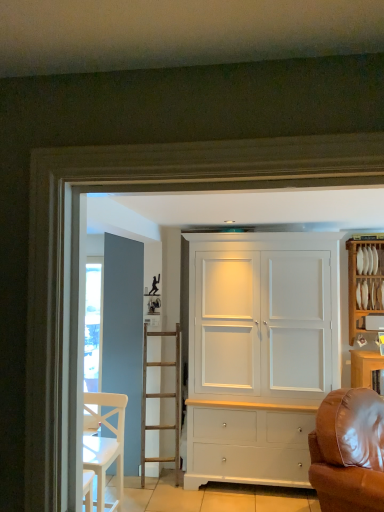
You are a GUI agent. You are given a task and a screenshot of the screen. Output one action in this format:
    pyautogui.click(x=<x>, y=<y>)
    Task: Click on the white matte cabinet at center
    The height and width of the screenshot is (512, 384).
    Given the screenshot: What is the action you would take?
    pyautogui.click(x=259, y=353)

Describe the element at coordinates (349, 451) in the screenshot. I see `brown leather couch at right` at that location.

You are a GUI agent. You are given a task and a screenshot of the screen. Output one action in this format:
    pyautogui.click(x=<x>, y=<y>)
    Task: Click on the white matte cabinet at center
    
    Given the screenshot: What is the action you would take?
    pyautogui.click(x=259, y=353)

Which object is closer to the camera taking this photo, brown leather couch at right or white matte cabinet at center?

brown leather couch at right.

Considering the relative sizes of brown leather couch at right and white matte cabinet at center in the image provided, is brown leather couch at right thinner than white matte cabinet at center?

Correct, the width of brown leather couch at right is less than that of white matte cabinet at center.

From a real-world perspective, between brown leather couch at right and white matte cabinet at center, who is vertically lower?

From a 3D spatial view, brown leather couch at right is below.

Which of these two, brown leather couch at right or white matte cabinet at center, stands shorter?

brown leather couch at right is shorter.

From the image's perspective, is brown leather couch at right on top of white wooden chair at lower left?

No.

Is brown leather couch at right next to white wooden chair at lower left?

No, brown leather couch at right is not in contact with white wooden chair at lower left.

From the image's perspective, would you say white matte cabinet at center is shown under white wooden chair at lower left?

Incorrect, from the image's perspective, white matte cabinet at center is higher than white wooden chair at lower left.

Is point (192, 388) closer to camera compared to point (112, 402)?

That is False.

Can you confirm if white matte cabinet at center is bigger than white wooden chair at lower left?

Yes, white matte cabinet at center is bigger than white wooden chair at lower left.

From a real-world perspective, is white wood cabinet at right below white matte cabinet at center?

No, from a real-world perspective, white wood cabinet at right is not under white matte cabinet at center.

Locate an element on the screen. cabinetry that appears above the white matte cabinet at center (from the image's perspective) is located at coordinates (364, 281).

Based on their positions, is white wood cabinet at right located to the left or right of white matte cabinet at center?

In the image, white wood cabinet at right appears on the right side of white matte cabinet at center.

From the image's perspective, between white wood cabinet at right and white matte cabinet at center, who is located below?

white matte cabinet at center.

Does white matte cabinet at center lie behind brown leather couch at right?

Yes, it is behind brown leather couch at right.

How much distance is there between white matte cabinet at center and brown leather couch at right?

white matte cabinet at center is 33.84 inches away from brown leather couch at right.

Is point (260, 276) closer or farther from the camera than point (338, 400)?

Point (260, 276).

Between white matte cabinet at center and brown leather couch at right, which one appears on the right side from the viewer's perspective?

brown leather couch at right is more to the right.

From a real-world perspective, which is physically above, white wooden chair at lower left or brown leather couch at right?

From a 3D spatial view, white wooden chair at lower left is above.

Looking at their sizes, would you say white wooden chair at lower left is wider or thinner than brown leather couch at right?

Considering their sizes, white wooden chair at lower left looks slimmer than brown leather couch at right.

In the image, is white wooden chair at lower left on the left side or the right side of brown leather couch at right?

white wooden chair at lower left is positioned on brown leather couch at right's left side.

Which object is further away from the camera taking this photo, white wooden chair at lower left or brown leather couch at right?

white wooden chair at lower left is more distant.

Based on the photo, from the image's perspective, is white wood cabinet at right beneath brown leather couch at right?

No, from the image's perspective, white wood cabinet at right is not beneath brown leather couch at right.

Is brown leather couch at right completely or partially inside white wood cabinet at right?

No, brown leather couch at right is located outside of white wood cabinet at right.

Measure the distance from white wood cabinet at right to brown leather couch at right.

white wood cabinet at right and brown leather couch at right are 4.86 feet apart from each other.

In the image, there is a white matte cabinet at center. Where is `studio couch below it (from the image's perspective)`? This screenshot has width=384, height=512. studio couch below it (from the image's perspective) is located at coordinates (349, 451).

I want to click on studio couch below the white wooden chair at lower left (from a real-world perspective), so click(x=349, y=451).

Which object lies further to the anchor point white wooden chair at lower left, white matte cabinet at center or white wood cabinet at right?

white wood cabinet at right is further to white wooden chair at lower left.

Consider the image. When comparing their distances from white wooden chair at lower left, does white wood cabinet at right or white matte cabinet at center seem closer?

Based on the image, white matte cabinet at center appears to be nearer to white wooden chair at lower left.

Based on their spatial positions, is white wooden chair at lower left or brown leather couch at right further from white wood cabinet at right?

white wooden chair at lower left lies further to white wood cabinet at right than the other object.

Consider the image. Based on their spatial positions, is white wood cabinet at right or white wooden chair at lower left closer to brown leather couch at right?

Based on the image, white wood cabinet at right appears to be nearer to brown leather couch at right.

When comparing their distances from white wood cabinet at right, does white matte cabinet at center or brown leather couch at right seem closer?

white matte cabinet at center lies closer to white wood cabinet at right than the other object.

Considering their positions, is brown leather couch at right positioned further to white wood cabinet at right than white wooden chair at lower left?

Based on the image, white wooden chair at lower left appears to be further to white wood cabinet at right.

Estimate the real-world distances between objects in this image. Which object is further from white wood cabinet at right, white matte cabinet at center or white wooden chair at lower left?

Based on the image, white wooden chair at lower left appears to be further to white wood cabinet at right.

When comparing their distances from brown leather couch at right, does white matte cabinet at center or white wooden chair at lower left seem closer?

Among the two, white matte cabinet at center is located nearer to brown leather couch at right.

I want to click on cupboard between white wooden chair at lower left and white wood cabinet at right, so click(259, 353).

The width and height of the screenshot is (384, 512). Find the location of `cupboard between white wooden chair at lower left and brown leather couch at right in the horizontal direction`. cupboard between white wooden chair at lower left and brown leather couch at right in the horizontal direction is located at coordinates (259, 353).

Find the location of a particular element. studio couch located between white wooden chair at lower left and white wood cabinet at right in the left-right direction is located at coordinates (349, 451).

Locate an element on the screen. cupboard between brown leather couch at right and white wood cabinet at right from front to back is located at coordinates (259, 353).